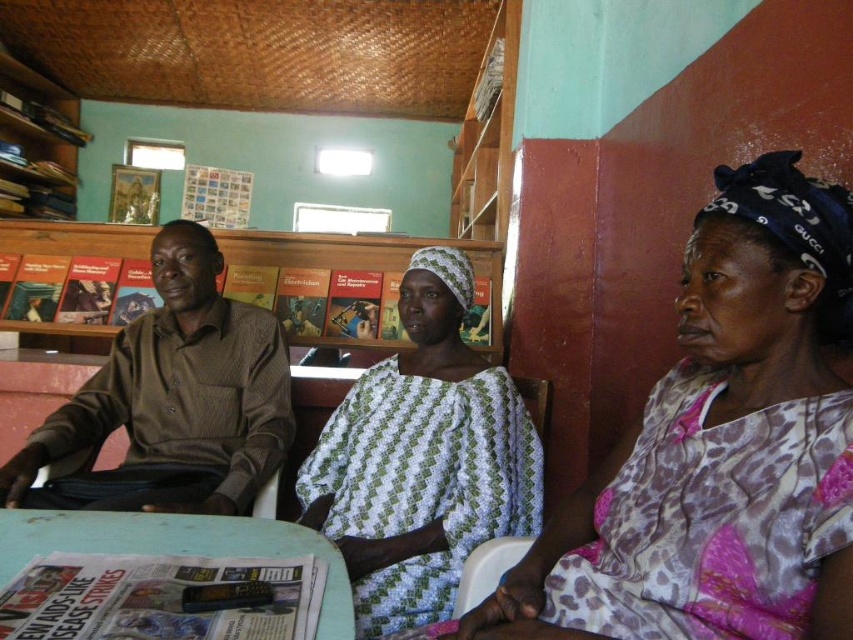
Is printed fabric headscarf at upper right thinner than brown textured shirt at left?

Indeed, printed fabric headscarf at upper right has a lesser width compared to brown textured shirt at left.

Is printed fabric headscarf at upper right shorter than brown textured shirt at left?

Indeed, printed fabric headscarf at upper right has a lesser height compared to brown textured shirt at left.

Between point (746, 332) and point (277, 330), which one is positioned behind?

Point (277, 330)

The image size is (853, 640). I want to click on printed fabric headscarf at upper right, so click(720, 448).

Does printed fabric headscarf at upper right appear under wooden bookshelf at upper left?

Correct, printed fabric headscarf at upper right is located below wooden bookshelf at upper left.

At what (x,y) coordinates should I click in order to perform the action: click on printed fabric headscarf at upper right. Please return your answer as a coordinate pair (x, y). The image size is (853, 640). Looking at the image, I should click on (720, 448).

Does brown textured shirt at left have a greater width compared to wooden bookshelf at upper left?

Yes.

Is brown textured shirt at left to the right of wooden bookshelf at upper left from the viewer's perspective?

Indeed, brown textured shirt at left is positioned on the right side of wooden bookshelf at upper left.

Which is behind, point (242, 374) or point (54, 161)?

The point (54, 161) is more distant.

Where is `brown textured shirt at left`? This screenshot has width=853, height=640. brown textured shirt at left is located at coordinates (172, 401).